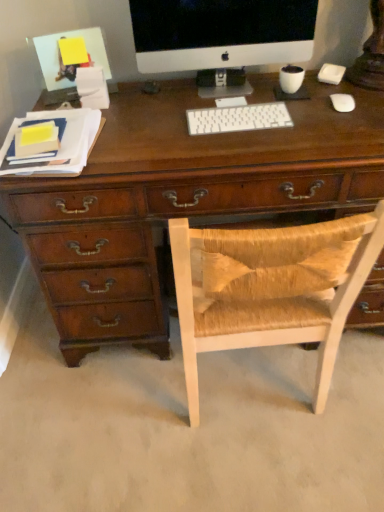
Question: From a real-world perspective, is white plastic keyboard at center above or below white matte mouse at right?

Choices:
 (A) below
 (B) above

Answer: (A)

Question: From the image's perspective, is white plastic keyboard at center above or below white matte mouse at right?

Choices:
 (A) below
 (B) above

Answer: (A)

Question: Considering the real-world distances, which object is farthest from the white glossy computer monitor at upper center?

Choices:
 (A) white plastic keyboard at center
 (B) woven wood chair at center
 (C) white matte mouse at right

Answer: (B)

Question: Considering the real-world distances, which object is farthest from the white glossy computer monitor at upper center?

Choices:
 (A) woven wood chair at center
 (B) white matte mouse at right
 (C) white plastic keyboard at center

Answer: (A)